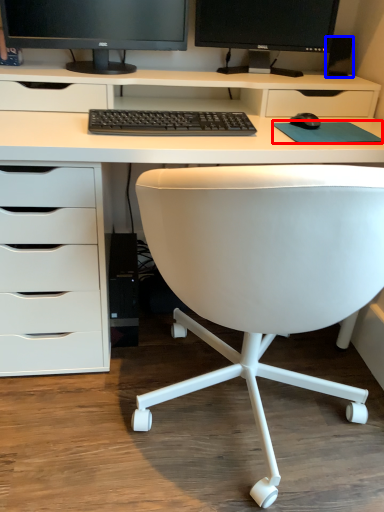
Question: Which object is further to the camera taking this photo, mousepad (highlighted by a red box) or speaker (highlighted by a blue box)?

Choices:
 (A) mousepad
 (B) speaker

Answer: (B)